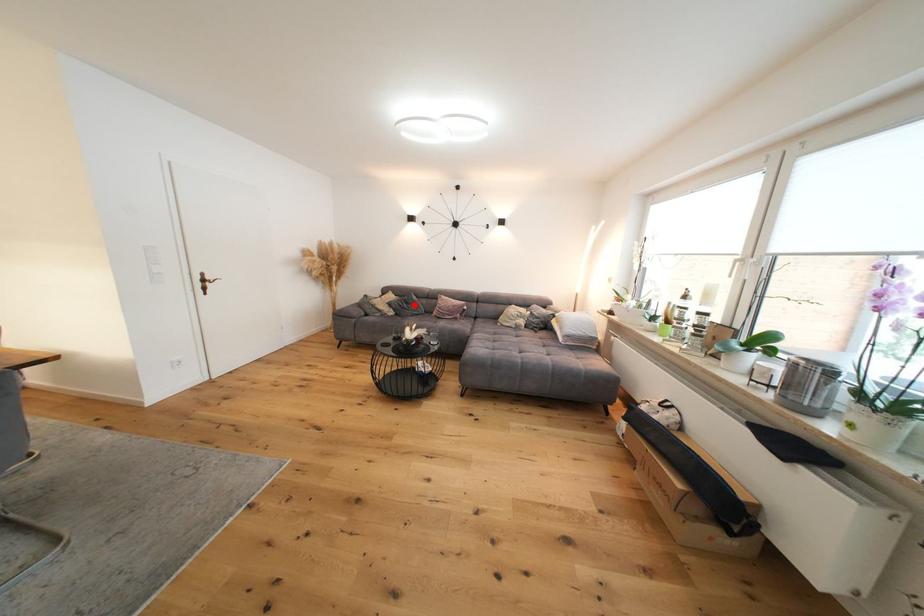
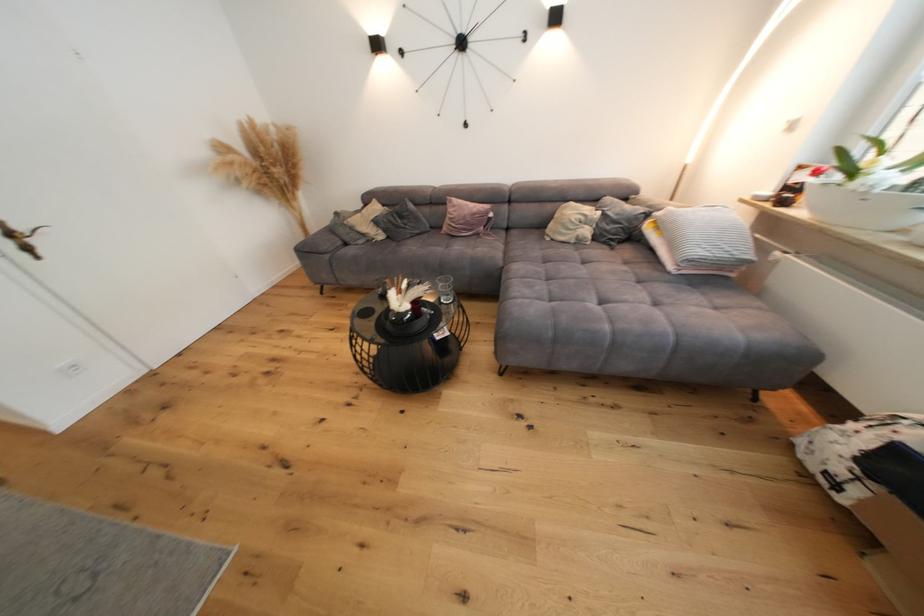
Question: A red point is marked in image1. In image2, is the corresponding 3D point closer to the camera or farther? Reply with the corresponding letter.

Choices:
 (A) The corresponding 3D point is closer.
 (B) The corresponding 3D point is farther.

Answer: (A)